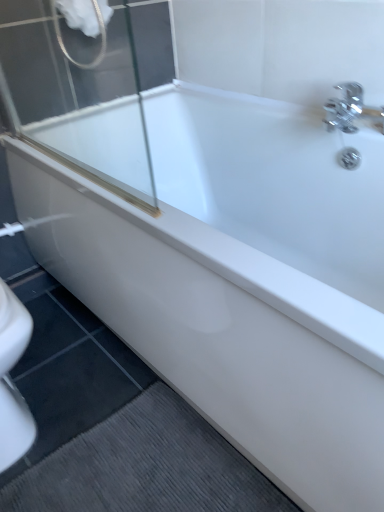
Question: In terms of size, does white matte shower head at upper left appear bigger or smaller than gray textured bath mat at lower left?

Choices:
 (A) small
 (B) big

Answer: (B)

Question: From a real-world perspective, is white matte shower head at upper left above or below gray textured bath mat at lower left?

Choices:
 (A) above
 (B) below

Answer: (A)

Question: Is white matte shower head at upper left inside the boundaries of gray textured bath mat at lower left, or outside?

Choices:
 (A) inside
 (B) outside

Answer: (B)

Question: Is gray textured bath mat at lower left to the left or to the right of white matte shower head at upper left in the image?

Choices:
 (A) left
 (B) right

Answer: (B)

Question: Is gray textured bath mat at lower left wider or thinner than white matte shower head at upper left?

Choices:
 (A) thin
 (B) wide

Answer: (B)

Question: From a real-world perspective, relative to white matte shower head at upper left, is gray textured bath mat at lower left vertically above or below?

Choices:
 (A) above
 (B) below

Answer: (B)

Question: From their relative heights in the image, would you say gray textured bath mat at lower left is taller or shorter than white matte shower head at upper left?

Choices:
 (A) short
 (B) tall

Answer: (A)